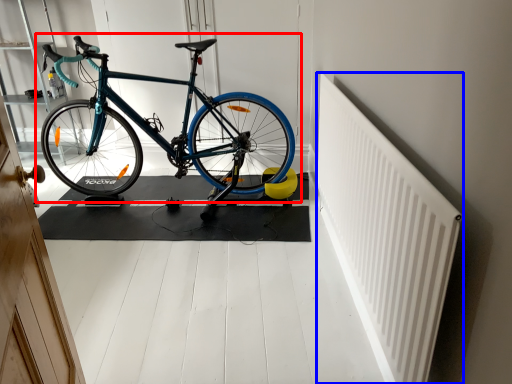
Question: Which object is further to the camera taking this photo, bicycle (highlighted by a red box) or radiator (highlighted by a blue box)?

Choices:
 (A) bicycle
 (B) radiator

Answer: (A)